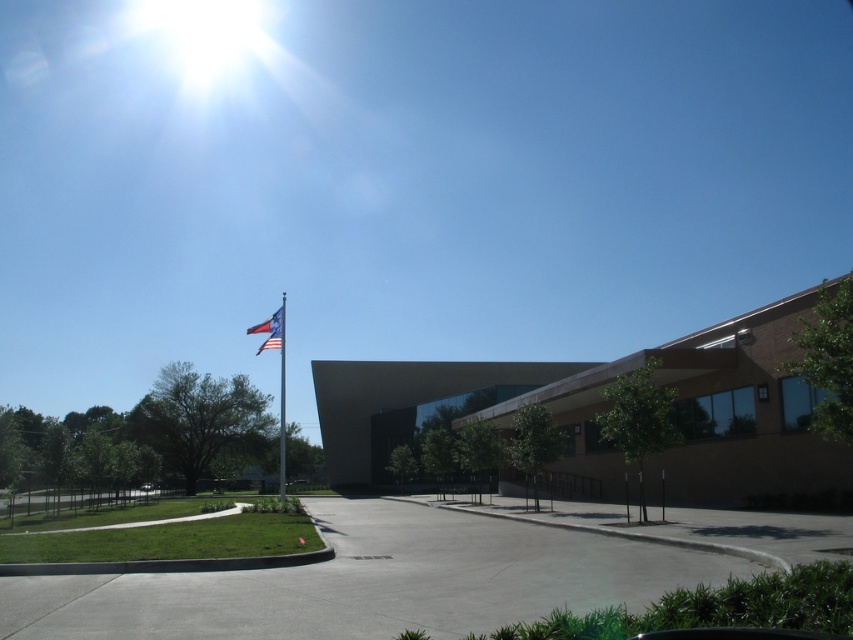
You are standing in front of the modern building and want to walk towards the entrance. There is a polished metal flag pole at center and an american flag at upper left in your view. Which object will you pass first as you walk towards the entrance?

You will pass the polished metal flag pole at center first because it is closer to you than the american flag at upper left, which is further away.

You are a city planner assessing the visibility of the flags on the polished metal flag pole at center and the american flag at upper left. Which flag has a larger width when viewed from the main road?

The american flag at upper left is wider than the polished metal flag pole at center, so the american flag at upper left would appear larger in width when viewed from the main road.

You are standing in front of the modern building and want to take a photo that includes both point (281, 340) and point (270, 317). Since you want the closer point to be in focus, which point should you focus on?

Point (281, 340) is closer to the camera than point (270, 317), so you should focus on point (281, 340) to ensure it is in focus.